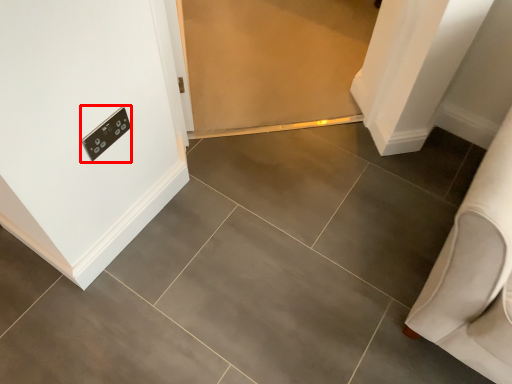
Question: From the image's perspective, where is light switch (annotated by the red box) located in relation to furniture in the image?

Choices:
 (A) above
 (B) below

Answer: (A)